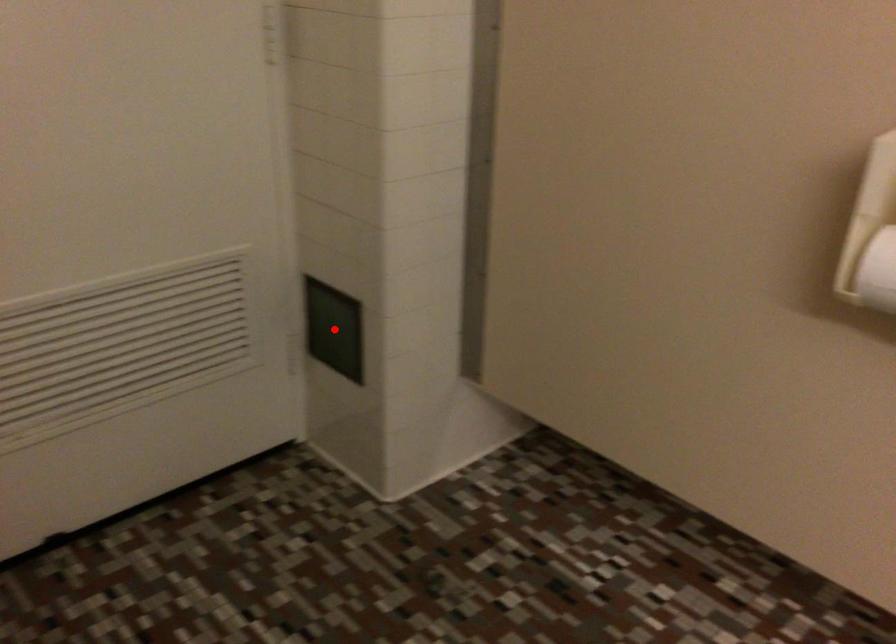
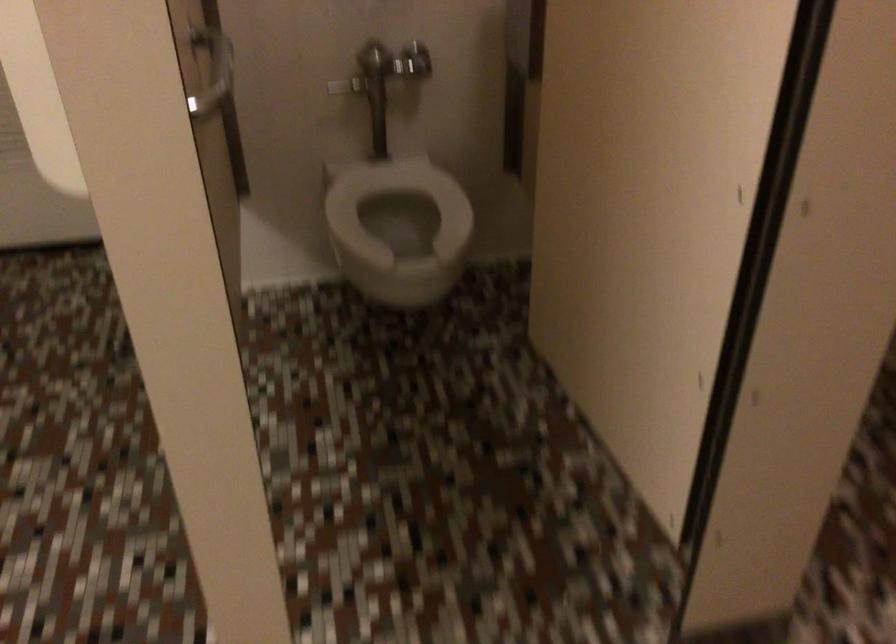
Question: I am providing you with two images of the same scene from different viewpoints. A red point is marked on the first image. At the location where the point appears in image 1, is it still visible in image 2?

Choices:
 (A) Yes
 (B) No

Answer: (B)